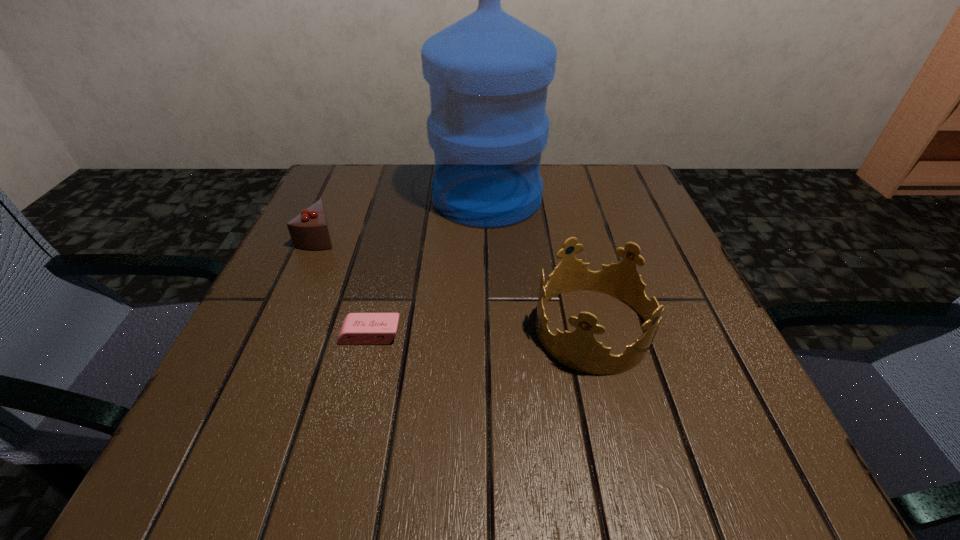
Find the location of a particular element. vacant point located between the leftmost object and the eraser is located at coordinates (345, 285).

The width and height of the screenshot is (960, 540). What are the coordinates of `free area in between the second object from left to right and the water jug` in the screenshot? It's located at (429, 266).

Identify which object is the second closest to the third tallest object. Please provide its 2D coordinates. Your answer should be formatted as a tuple, i.e. [(x, y)], where the tuple contains the x and y coordinates of a point satisfying the conditions above.

[(357, 328)]

Identify which object is located as the third nearest to the leftmost object. Please provide its 2D coordinates. Your answer should be formatted as a tuple, i.e. [(x, y)], where the tuple contains the x and y coordinates of a point satisfying the conditions above.

[(579, 350)]

The image size is (960, 540). In order to click on free region that satisfies the following two spatial constraints: 1. on the front side of the third object from right to left; 2. on the left side of the leftmost object in this screenshot , I will do `click(275, 335)`.

The height and width of the screenshot is (540, 960). Identify the location of free spot that satisfies the following two spatial constraints: 1. on the back side of the shortest object; 2. on the left side of the water jug. (403, 198).